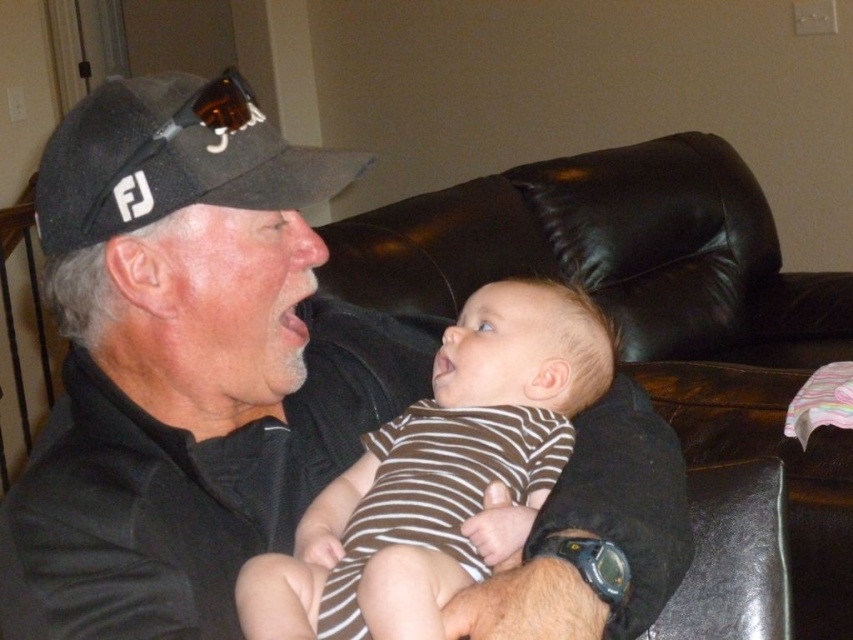
Is brown striped onesie at center shorter than black fabric baseball cap at upper left?

No, brown striped onesie at center is not shorter than black fabric baseball cap at upper left.

In the scene shown: Can you confirm if brown striped onesie at center is thinner than black fabric baseball cap at upper left?

In fact, brown striped onesie at center might be wider than black fabric baseball cap at upper left.

This screenshot has height=640, width=853. What are the coordinates of `brown striped onesie at center` in the screenshot? It's located at (440, 476).

In the scene shown: Is black leather couch at center bigger than black fabric baseball cap at upper left?

Indeed, black leather couch at center has a larger size compared to black fabric baseball cap at upper left.

Who is more forward, [817,557] or [106,180]?

Point [106,180]

What are the coordinates of `black leather couch at center` in the screenshot? It's located at (650, 310).

Is black matte cap at upper left to the left of brown striped onesie at center from the viewer's perspective?

Yes, black matte cap at upper left is to the left of brown striped onesie at center.

Does black matte cap at upper left have a larger size compared to brown striped onesie at center?

Yes, black matte cap at upper left is bigger than brown striped onesie at center.

Is point (656, 600) positioned after point (376, 621)?

Yes, point (656, 600) is behind point (376, 621).

This screenshot has width=853, height=640. In order to click on black matte cap at upper left in this screenshot , I will do `click(186, 364)`.